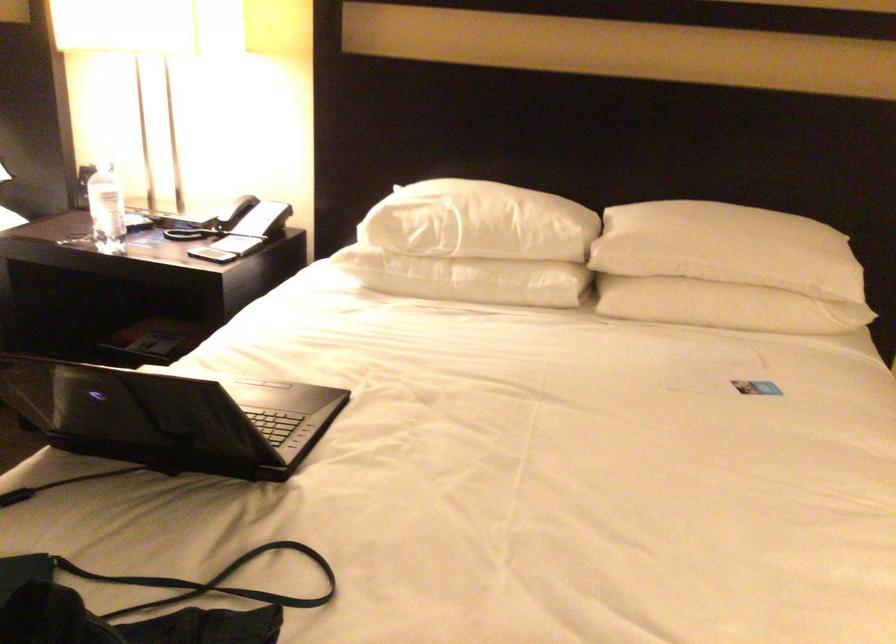
Image resolution: width=896 pixels, height=644 pixels. Describe the element at coordinates (185, 418) in the screenshot. I see `the laptop lid` at that location.